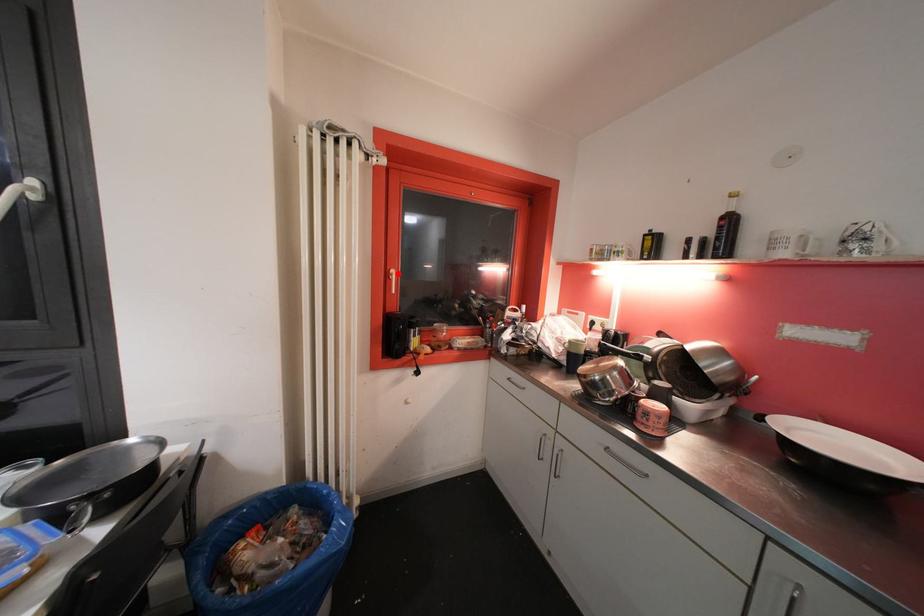
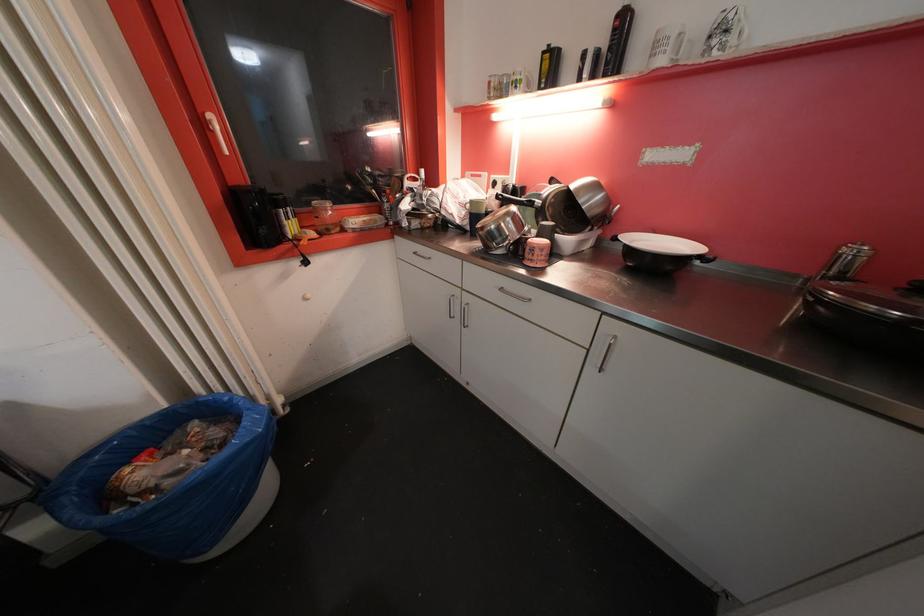
Question: I am providing you with two images of the same scene from different viewpoints. A red point is shown in image1. For the corresponding object point in image2, is it positioned nearer or farther from the camera?

Choices:
 (A) Nearer
 (B) Farther

Answer: (B)